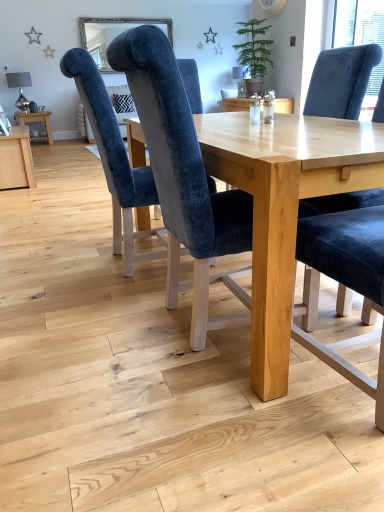
Question: Would you say light wood table at center, positioned as the 2th table in top-to-bottom order, is to the left or to the right of velvet blue chair at center, positioned as the 2th chair in right-to-left order, in the picture?

Choices:
 (A) right
 (B) left

Answer: (A)

Question: Is light wood table at center, which appears as the 2th table when viewed from the back, wider or thinner than velvet blue chair at center, positioned as the 2th chair in right-to-left order?

Choices:
 (A) thin
 (B) wide

Answer: (B)

Question: Based on their relative distances, which object is farther from the light wood table at center, arranged as the second table when viewed from the left?

Choices:
 (A) green matte potted plant at upper center
 (B) velvet blue chair at center, acting as the 1th chair starting from the left
 (C) velvet blue chair at center, the 3th chair when ordered from left to right
 (D) velvet blue chair at center, positioned as the 2th chair in right-to-left order
 (E) matte wooden table at left, the second table when ordered from bottom to top

Answer: (E)

Question: Which is nearer to the velvet blue chair at center, the 3th chair when ordered from left to right?

Choices:
 (A) light wood table at center, which is the 1th table in bottom-to-top order
 (B) matte wooden table at left, which ranks as the 2th table in right-to-left order
 (C) green matte potted plant at upper center
 (D) velvet blue chair at center, positioned as the 2th chair in right-to-left order
 (E) velvet blue chair at center, acting as the 1th chair starting from the left

Answer: (A)